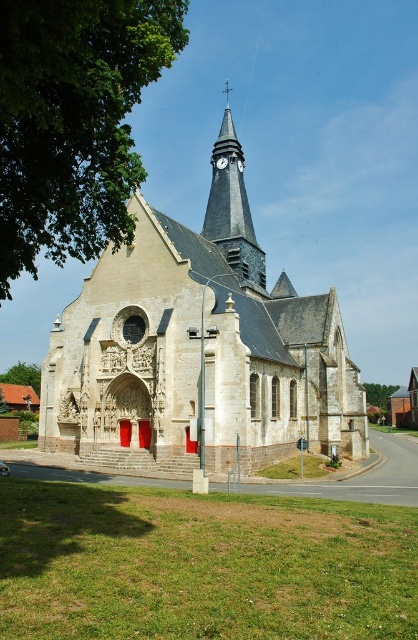
You are standing in front of the church and want to take a photo of both the dark gray stone clock tower at upper center and the green leafy tree at lower left. Which object should you focus on first to ensure both are in the frame?

You should focus on the green leafy tree at lower left first because the dark gray stone clock tower at upper center is located above it, so adjusting the camera angle to include the lower tree will naturally capture the tower above.

You are an architect planning to build a new structure that must fit within the space currently occupied by the light beige stone church at center and the dark gray stone clock tower at upper center. If the total available width is 20 meters, what is the minimum width required for the new structure to accommodate both objects without overlapping?

The light beige stone church at center has a larger width than the dark gray stone clock tower at upper center. To accommodate both without overlapping, the minimum width required would be the sum of their widths. However, since the exact dimensions are not provided, we can only state that the new structure must be wider than the combined width of both objects. Since the church is wider, the total minimum width would be greater than the church alone. Unfortunately, without specific measurements, an exact 20

You are standing at a certain distance from the light beige stone church at center. If you want to take a photo of it with your camera, which is 57.68 meters away, will you be able to capture the entire church in one shot without moving closer or farther away?

The light beige stone church at center and camera are 57.68 meters apart, so you can capture the entire church in one shot if your camera has a wide enough lens. The distance itself does not prevent capturing the entire structure, but the field of view of your camera matters.